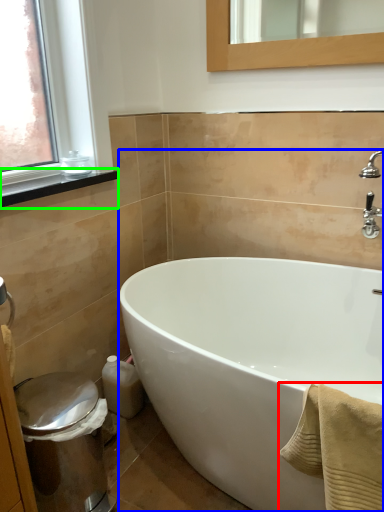
Question: Considering the real-world distances, which object is closest to bath towel (highlighted by a red box)? bathtub (highlighted by a blue box) or window sill (highlighted by a green box).

Choices:
 (A) bathtub
 (B) window sill

Answer: (A)